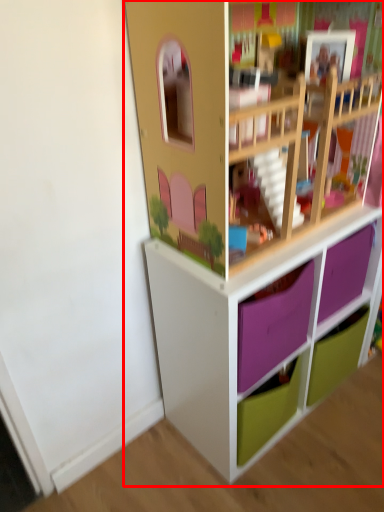
Question: From the image's perspective, considering the relative positions of shelf (annotated by the red box) and drawer in the image provided, where is shelf (annotated by the red box) located with respect to the staircase?

Choices:
 (A) above
 (B) below

Answer: (A)